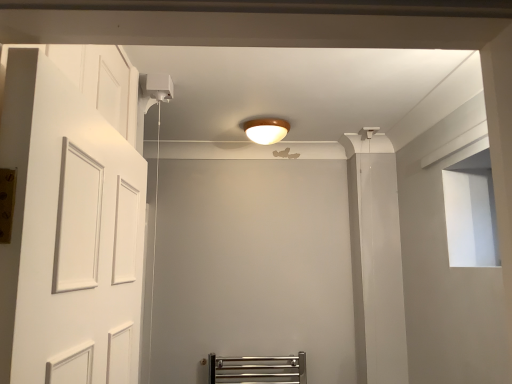
Describe the element at coordinates (266, 130) in the screenshot. This screenshot has height=384, width=512. I see `wooden ceiling light at center` at that location.

I want to click on wooden ceiling light at center, so click(266, 130).

The height and width of the screenshot is (384, 512). In order to click on wooden ceiling light at center in this screenshot , I will do `click(266, 130)`.